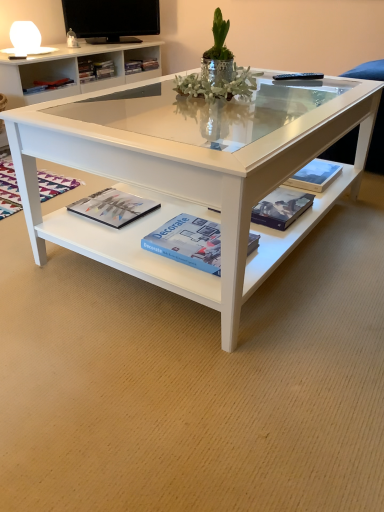
In order to click on vacant area on top of matte black magazine at lower center, the second magazine viewed from the right (from a real-world perspective) in this screenshot , I will do `click(117, 203)`.